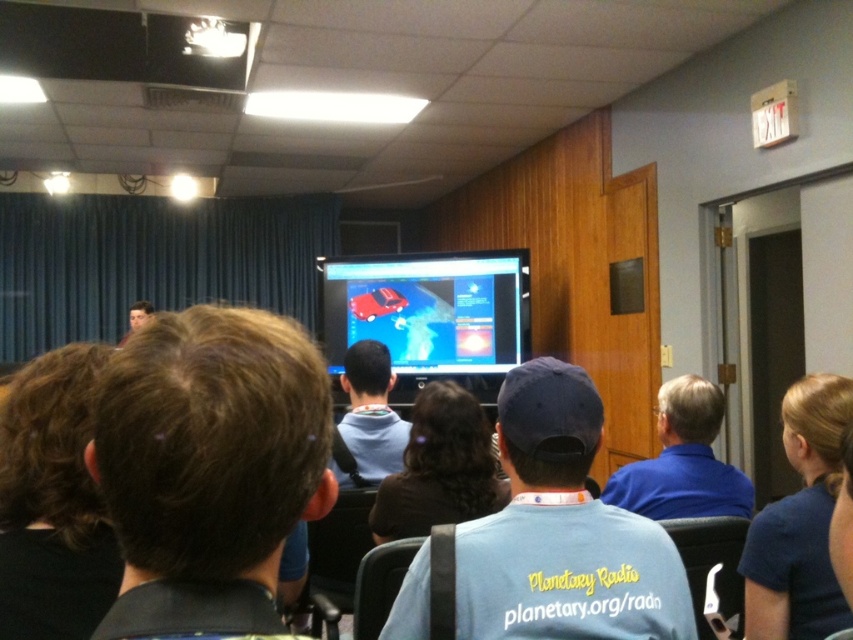
Who is more distant from viewer, (277, 474) or (836, 582)?

Positioned behind is point (836, 582).

Is point (292, 413) positioned in front of point (795, 392)?

Yes.

Does point (222, 472) come closer to viewer compared to point (776, 515)?

Yes, point (222, 472) is closer to viewer.

Identify the location of brown hair at upper left. The image size is (853, 640). (209, 468).

Can you confirm if light blue cotton t-shirt at center is smaller than brown hair at center?

Correct, light blue cotton t-shirt at center occupies less space than brown hair at center.

In the scene shown: Does light blue cotton t-shirt at center have a lesser height compared to brown hair at center?

Correct, light blue cotton t-shirt at center is not as tall as brown hair at center.

What do you see at coordinates (561, 531) in the screenshot? This screenshot has width=853, height=640. I see `light blue cotton t-shirt at center` at bounding box center [561, 531].

You are a GUI agent. You are given a task and a screenshot of the screen. Output one action in this format:
    pyautogui.click(x=<x>, y=<y>)
    Task: Click on the light blue cotton t-shirt at center
    This screenshot has width=853, height=640.
    Given the screenshot: What is the action you would take?
    pyautogui.click(x=561, y=531)

Which is below, brown hair at center or light blue hoodie at center?

brown hair at center is lower down.

What do you see at coordinates (439, 467) in the screenshot?
I see `brown hair at center` at bounding box center [439, 467].

You are a GUI agent. You are given a task and a screenshot of the screen. Output one action in this format:
    pyautogui.click(x=<x>, y=<y>)
    Task: Click on the brown hair at center
    The width and height of the screenshot is (853, 640).
    Given the screenshot: What is the action you would take?
    pyautogui.click(x=439, y=467)